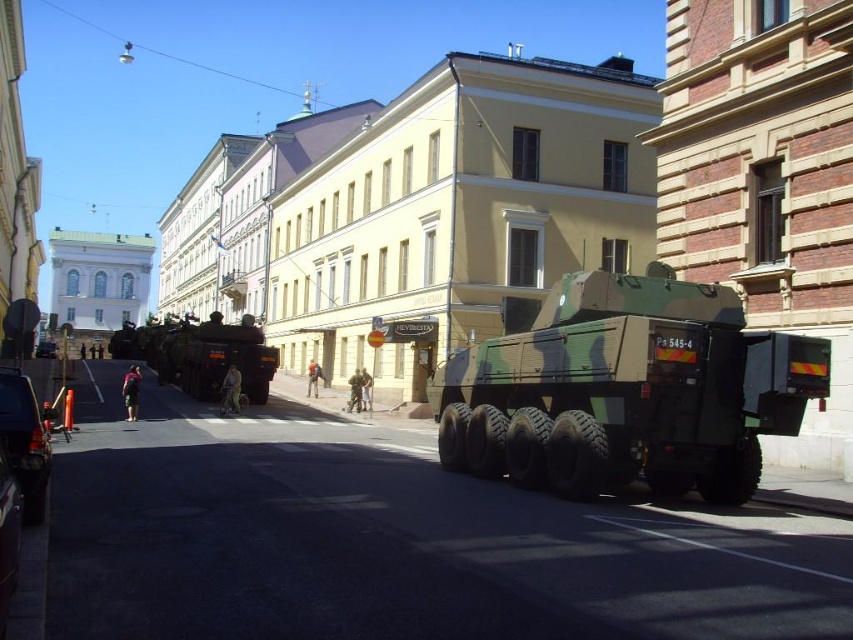
You are standing at the point with coordinates point (x=231, y=336) and want to walk to point (x=36, y=344). Is the destination point behind or in front of your current position?

Answer: The destination point (x=36, y=344) is behind your current position at point (x=231, y=336) because point (x=231, y=336) is in front of point (x=36, y=344).

You are a pedestrian standing on the street and want to cross to the other side. There is a matte black tank at left and a metallic blue truck at lower left. Which vehicle should you avoid stepping behind to stay visible to oncoming traffic?

You should avoid stepping behind the metallic blue truck at lower left because the matte black tank at left is to the left of it, blocking the view from oncoming traffic. Staying behind the truck would place you in a blind spot.

From the picture: You are a tour guide explaining the historical significance of the military vehicles in the image. Which military vehicle is located at the coordinates point (216, 356)?

The point (216, 356) indicates the location of the matte black tank at left.